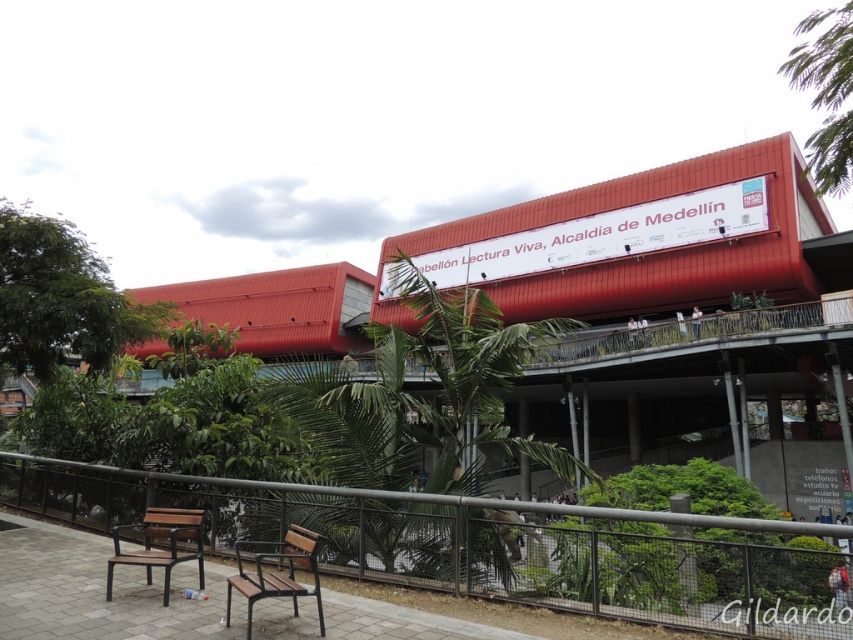
Question: Which of these objects is positioned farthest from the brown wooden bench at lower center?

Choices:
 (A) brown wooden bench at lower left
 (B) metal/rustic fence at lower center

Answer: (B)

Question: Can you confirm if metal/rustic fence at lower center is positioned below brown wooden bench at lower center?

Choices:
 (A) no
 (B) yes

Answer: (B)

Question: Which point is closer to the camera?

Choices:
 (A) (178, 536)
 (B) (260, 560)
 (C) (724, 620)

Answer: (C)

Question: Which of these objects is positioned closest to the brown wooden bench at lower center?

Choices:
 (A) brown wooden bench at lower left
 (B) metal/rustic fence at lower center

Answer: (A)

Question: Is metal/rustic fence at lower center bigger than brown wooden bench at lower center?

Choices:
 (A) no
 (B) yes

Answer: (B)

Question: Is metal/rustic fence at lower center bigger than brown wooden bench at lower center?

Choices:
 (A) no
 (B) yes

Answer: (B)